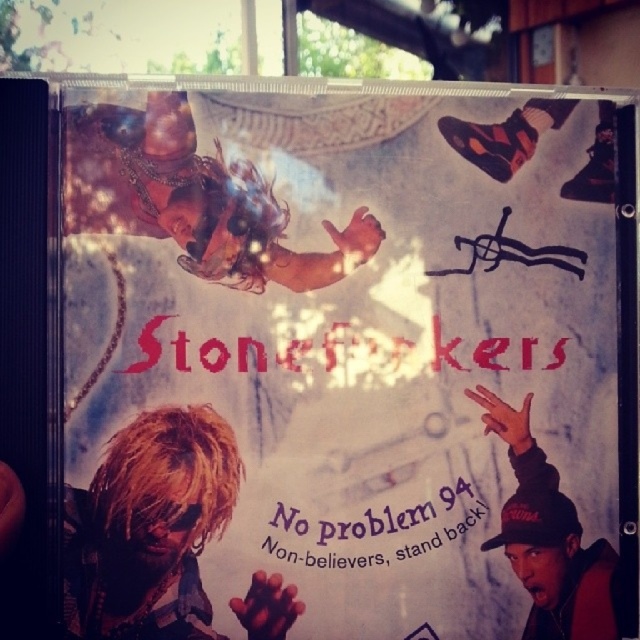
Question: Which of the following is the closest to the observer?

Choices:
 (A) (65, 154)
 (B) (525, 561)
 (C) (314, 544)
 (D) (253, 596)

Answer: (A)

Question: Does blonde hair at lower left appear on the left side of shiny gold necklace at upper center?

Choices:
 (A) yes
 (B) no

Answer: (A)

Question: Can you confirm if matte black cap at lower right is thinner than purple paper text at center?

Choices:
 (A) no
 (B) yes

Answer: (B)

Question: Considering the real-world distances, which object is closest to the blonde hair at lower left?

Choices:
 (A) purple paper text at center
 (B) shiny gold necklace at upper center

Answer: (A)

Question: Which point is farther to the camera?

Choices:
 (A) shiny gold necklace at upper center
 (B) blonde hair at lower left
 (C) purple paper text at center

Answer: (C)

Question: Is blonde hair at lower left to the left of purple paper text at center from the viewer's perspective?

Choices:
 (A) no
 (B) yes

Answer: (B)